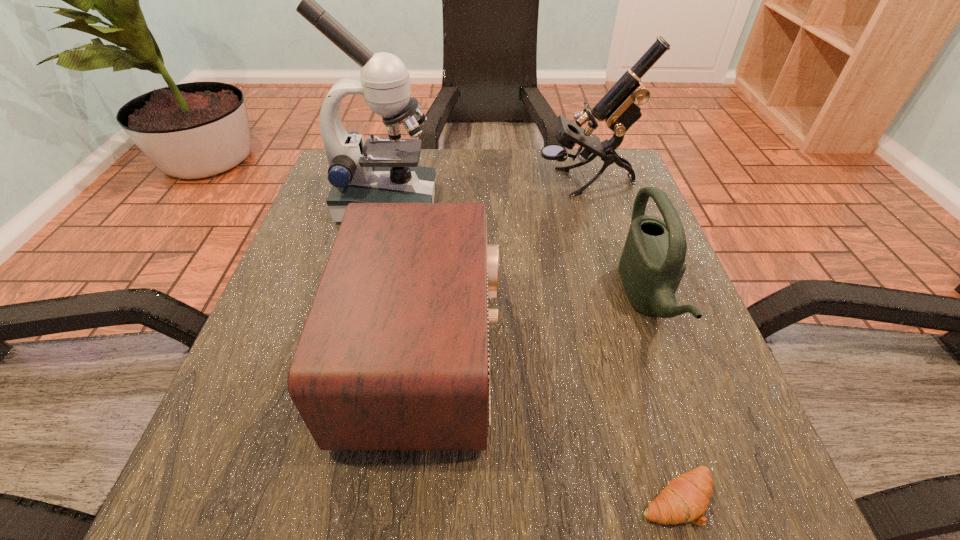
Identify the location of vacant region at the near left corner of the desktop. The height and width of the screenshot is (540, 960). (279, 468).

In the image, there is a desktop. Identify the location of vacant space at the far right corner. The width and height of the screenshot is (960, 540). (570, 190).

Locate an element on the screen. free spot between the nearest object and the fourth shortest object is located at coordinates (631, 340).

Where is `blank region between the nearest object and the radio receiver`? The width and height of the screenshot is (960, 540). blank region between the nearest object and the radio receiver is located at coordinates (551, 426).

The width and height of the screenshot is (960, 540). In order to click on unoccupied position between the nearest object and the right microscope in this screenshot , I will do `click(631, 340)`.

Where is `empty space that is in between the nearest object and the watering can`? The image size is (960, 540). empty space that is in between the nearest object and the watering can is located at coordinates (661, 399).

Locate an element on the screen. The height and width of the screenshot is (540, 960). empty space between the shorter microscope and the watering can is located at coordinates (615, 241).

The width and height of the screenshot is (960, 540). What are the coordinates of `blank region between the shortest object and the radio receiver` in the screenshot? It's located at (551, 426).

You are a GUI agent. You are given a task and a screenshot of the screen. Output one action in this format:
    pyautogui.click(x=<x>, y=<y>)
    Task: Click on the free space between the radio receiver and the shorter microscope
    
    Given the screenshot: What is the action you would take?
    pyautogui.click(x=505, y=268)

You are a GUI agent. You are given a task and a screenshot of the screen. Output one action in this format:
    pyautogui.click(x=<x>, y=<y>)
    Task: Click on the free space between the shortest object and the watering can
    This screenshot has width=960, height=540.
    Given the screenshot: What is the action you would take?
    pyautogui.click(x=661, y=399)